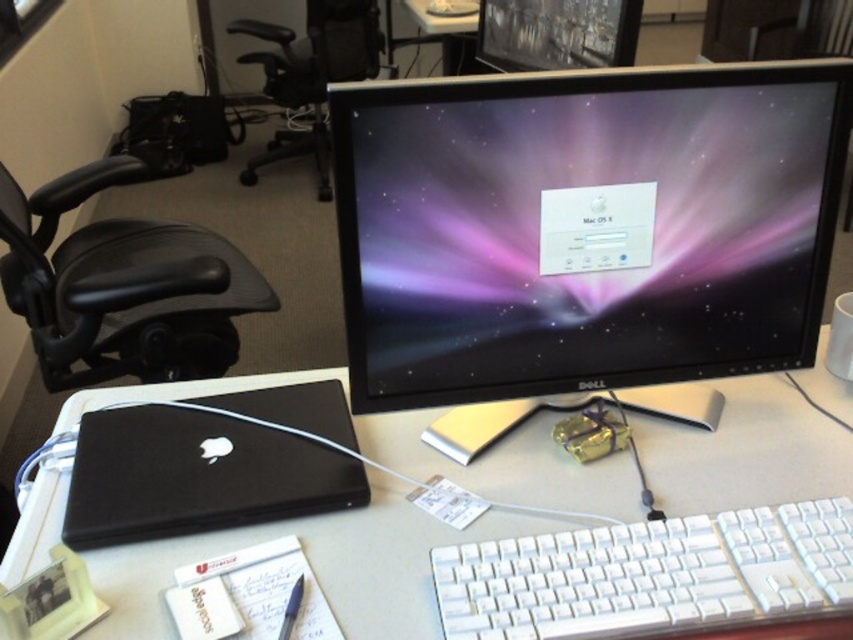
Question: Which point is closer to the camera?

Choices:
 (A) (538, 65)
 (B) (560, 600)
 (C) (212, 445)

Answer: (B)

Question: Is white plastic keyboard at lower center in front of matte black monitor at center?

Choices:
 (A) no
 (B) yes

Answer: (B)

Question: Can you confirm if black glossy monitor at center is positioned to the right of black plastic swivel chair at upper center?

Choices:
 (A) yes
 (B) no

Answer: (A)

Question: Which object is the closest to the white plastic computer desk at center?

Choices:
 (A) black glossy monitor at center
 (B) black matte laptop at lower left

Answer: (B)

Question: Is white plastic keyboard at lower center bigger than black matte laptop at lower left?

Choices:
 (A) no
 (B) yes

Answer: (A)

Question: Which point is farther to the camera?

Choices:
 (A) (592, 272)
 (B) (64, 410)
 (C) (48, 333)
 (D) (300, 56)

Answer: (D)